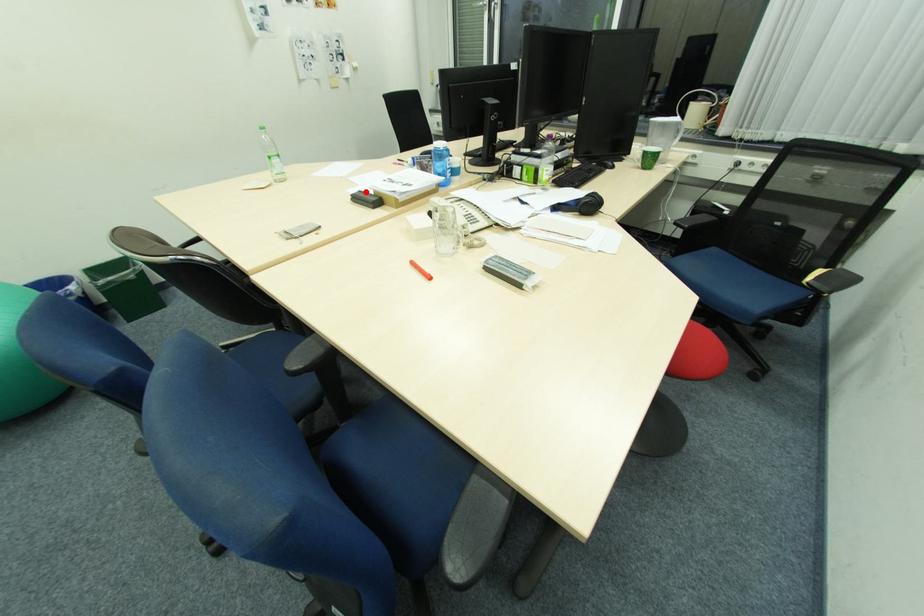
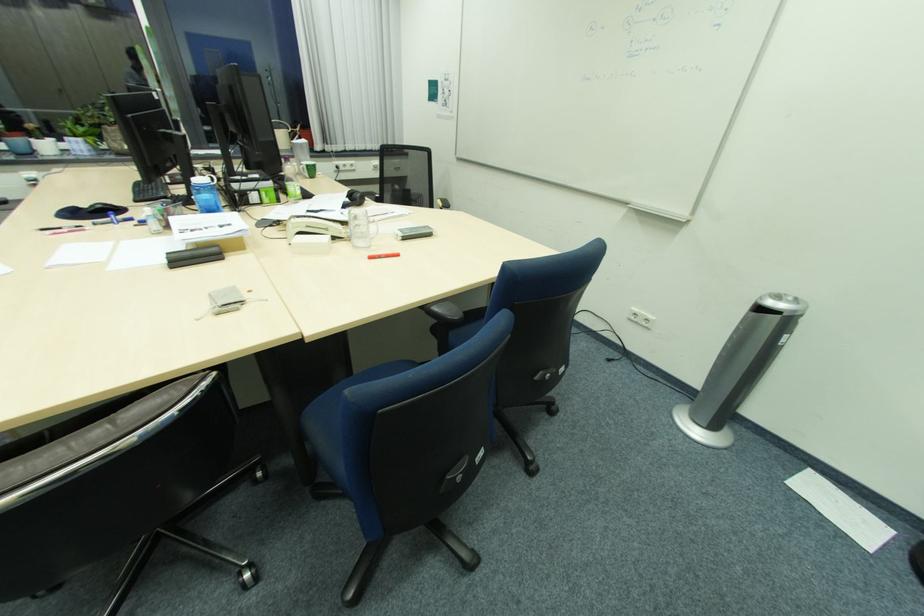
The point at the highlighted location is marked in the first image. Where is the corresponding point in the second image?

(175, 254)